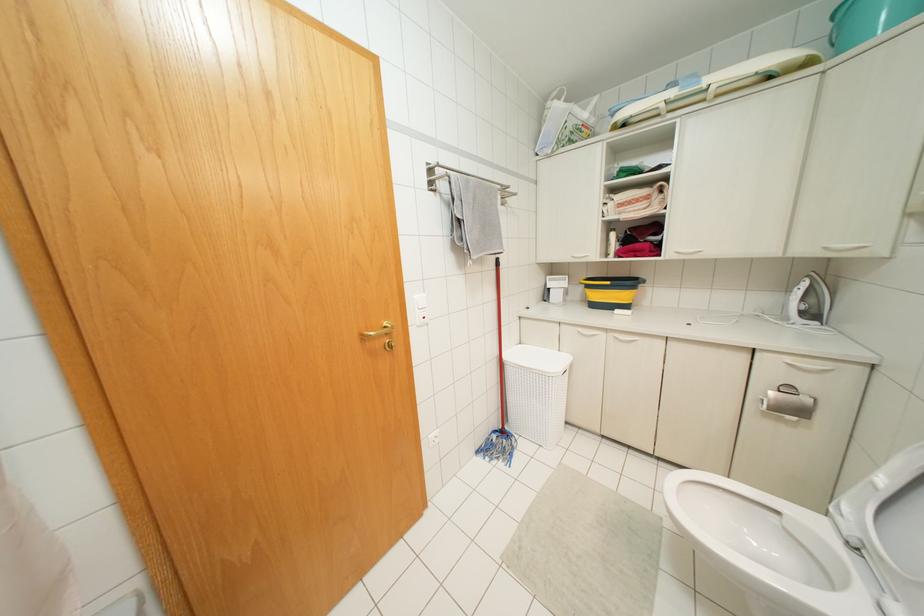
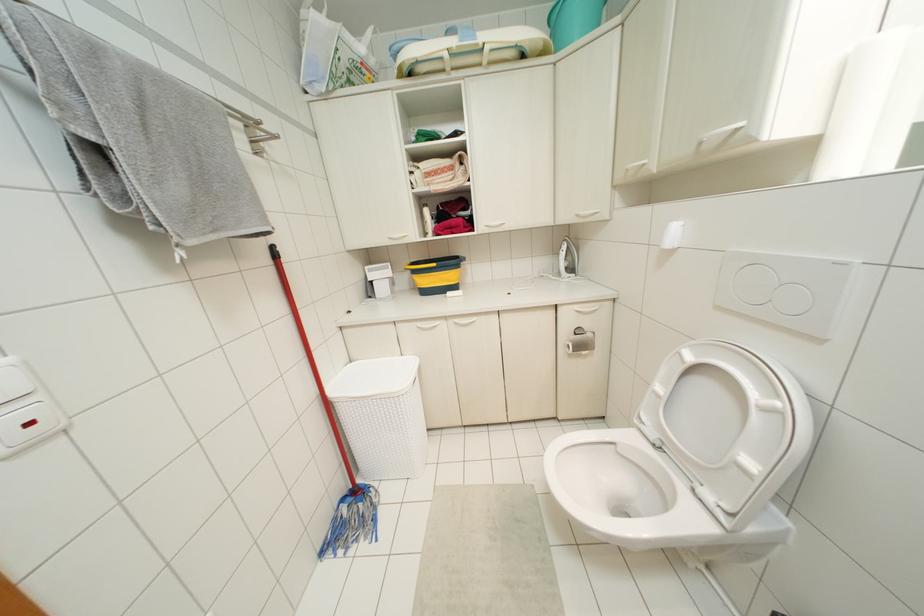
Find the pixel in the second image that matches (x=579, y=330) in the first image.

(419, 323)